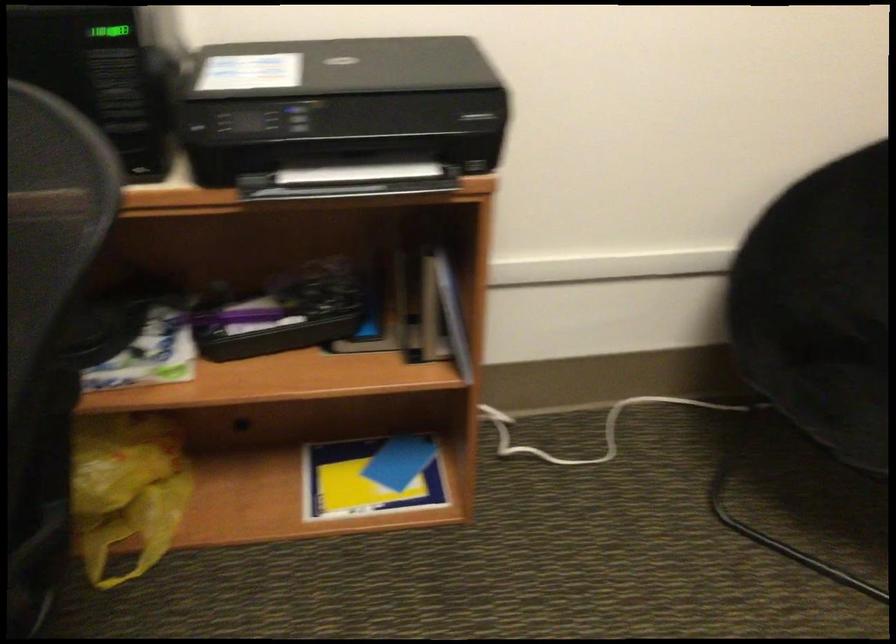
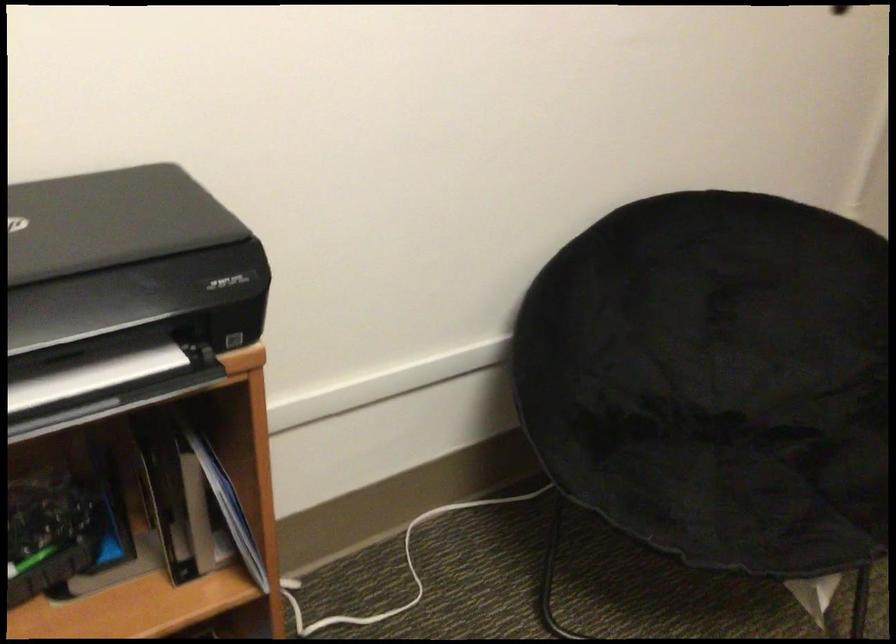
Question: Which direction would the cameraman need to move to produce the second image? Reply with the corresponding letter.

Choices:
 (A) Left
 (B) Right
 (C) Forward
 (D) Backward

Answer: (C)